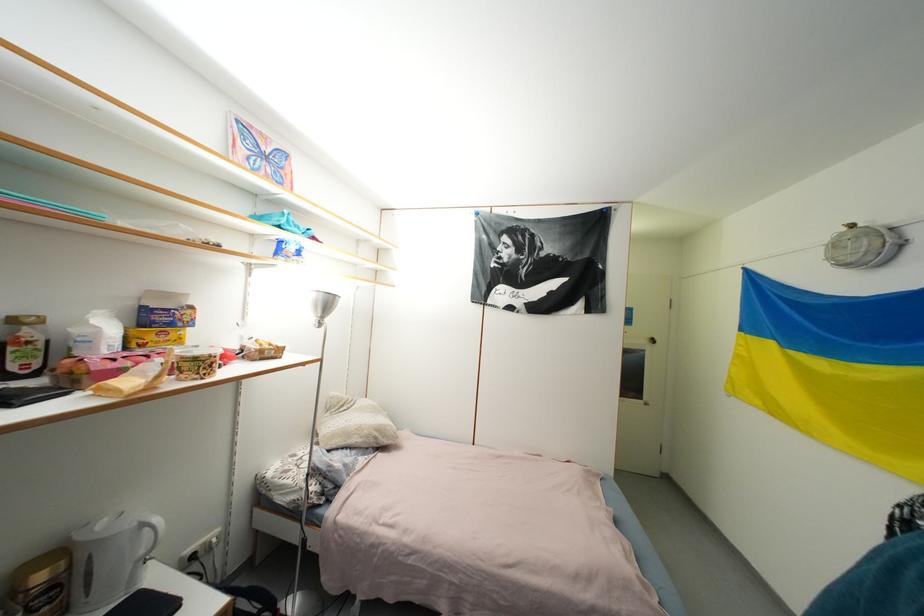
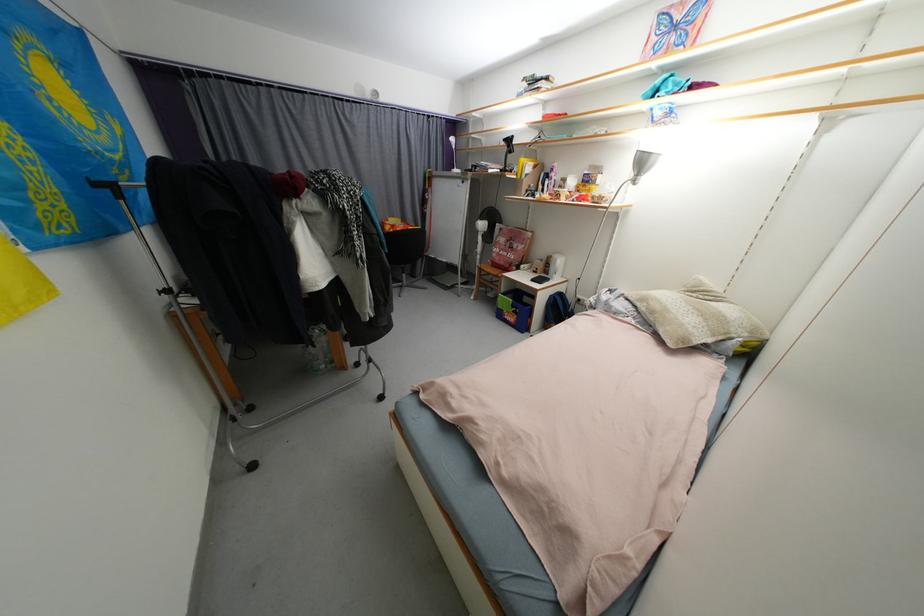
Where in the second image is the point corresponding to the point at 372,438 from the first image?

(658, 314)